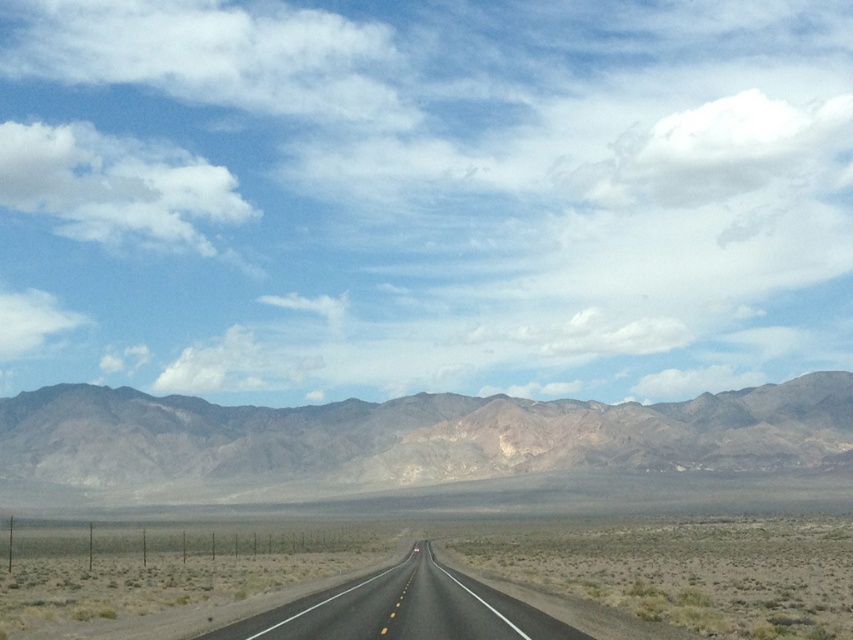
Question: Can you confirm if brown rocky mountain at center is smaller than black asphalt road at center?

Choices:
 (A) yes
 (B) no

Answer: (B)

Question: Which point is closer to the camera?

Choices:
 (A) black asphalt road at center
 (B) brown rocky mountain at center

Answer: (A)

Question: Which point is farther from the camera taking this photo?

Choices:
 (A) (540, 465)
 (B) (355, 611)

Answer: (A)

Question: In this image, where is brown rocky mountain at center located relative to black asphalt road at center?

Choices:
 (A) left
 (B) right

Answer: (A)

Question: Can you confirm if brown rocky mountain at center is positioned above black asphalt road at center?

Choices:
 (A) yes
 (B) no

Answer: (B)